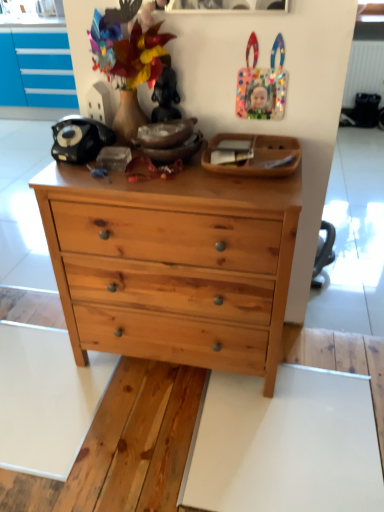
The height and width of the screenshot is (512, 384). In order to click on free space above natural wood chest of drawers at center (from a real-world perspective) in this screenshot , I will do `click(169, 175)`.